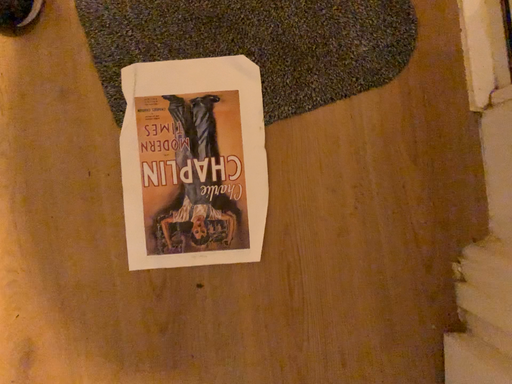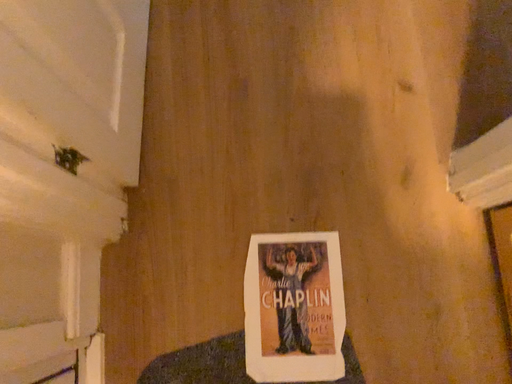
Question: Which way did the camera rotate in the video?

Choices:
 (A) rotated downward
 (B) rotated upward

Answer: (B)